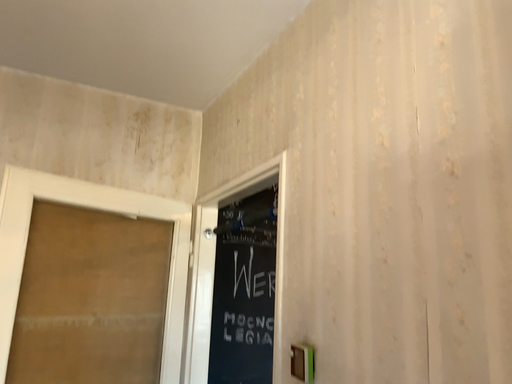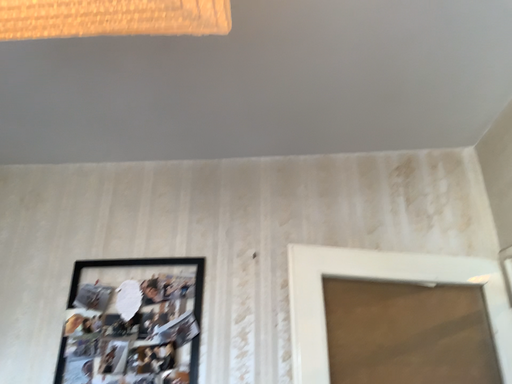
Question: Which way did the camera rotate in the video?

Choices:
 (A) rotated upward
 (B) rotated downward

Answer: (A)